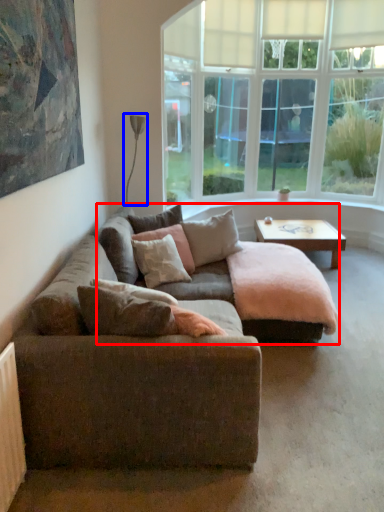
Question: Which object is closer to the camera taking this photo, couch (highlighted by a red box) or lamp (highlighted by a blue box)?

Choices:
 (A) couch
 (B) lamp

Answer: (A)